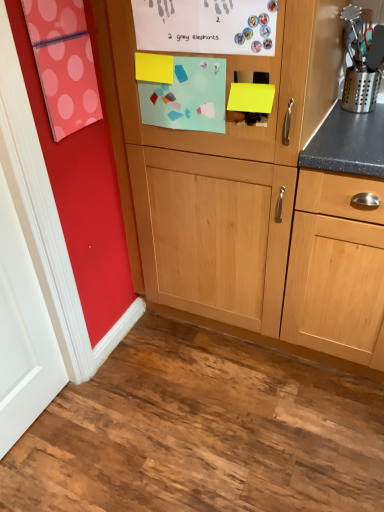
At what (x,y) coordinates should I click in order to perform the action: click on free space to the right of white matte door at left. Please return your answer as a coordinate pair (x, y). This screenshot has height=512, width=384. Looking at the image, I should click on (104, 419).